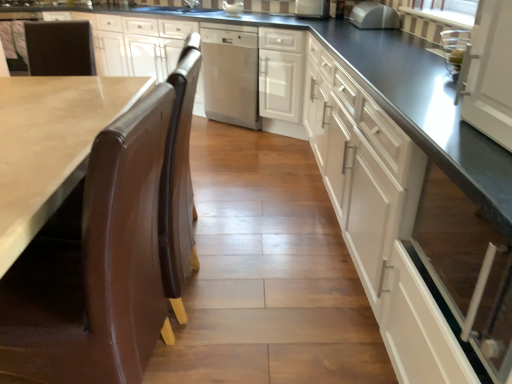
Question: From a real-world perspective, is white glossy cabinet at right, which appears as the first cabinetry when viewed from the front, below satin silver microwave at upper center, which ranks as the third appliance in back-to-front order?

Choices:
 (A) yes
 (B) no

Answer: (A)

Question: From the image's perspective, would you say white glossy cabinet at right, which appears as the first cabinetry when viewed from the front, is shown under satin silver microwave at upper center, which ranks as the third appliance in back-to-front order?

Choices:
 (A) yes
 (B) no

Answer: (A)

Question: Considering the relative sizes of white glossy cabinet at right, the 2th cabinetry in the back-to-front sequence, and satin silver microwave at upper center, the third appliance when ordered from left to right, in the image provided, is white glossy cabinet at right, the 2th cabinetry in the back-to-front sequence, thinner than satin silver microwave at upper center, the third appliance when ordered from left to right,?

Choices:
 (A) yes
 (B) no

Answer: (B)

Question: Is white glossy cabinet at right, which appears as the first cabinetry when viewed from the front, outside of satin silver microwave at upper center, the first appliance viewed from the right?

Choices:
 (A) yes
 (B) no

Answer: (A)

Question: Is white glossy cabinet at right, which appears as the first cabinetry when viewed from the front, facing away from satin silver microwave at upper center, the 1th appliance from the front?

Choices:
 (A) yes
 (B) no

Answer: (B)

Question: Considering the relative sizes of white glossy cabinet at right, the 2th cabinetry in the back-to-front sequence, and satin silver microwave at upper center, the third appliance when ordered from left to right, in the image provided, is white glossy cabinet at right, the 2th cabinetry in the back-to-front sequence, smaller than satin silver microwave at upper center, the third appliance when ordered from left to right,?

Choices:
 (A) no
 (B) yes

Answer: (A)

Question: Is there a large distance between white glossy cabinet at right, the 2th cabinetry in the back-to-front sequence, and stainless steel dishwasher at center?

Choices:
 (A) yes
 (B) no

Answer: (A)

Question: Is the position of white glossy cabinet at right, the 2th cabinetry in the back-to-front sequence, less distant than that of stainless steel dishwasher at center?

Choices:
 (A) no
 (B) yes

Answer: (B)

Question: From a real-world perspective, is white glossy cabinet at right, which appears as the first cabinetry when viewed from the front, under stainless steel dishwasher at center?

Choices:
 (A) yes
 (B) no

Answer: (A)

Question: From the image's perspective, would you say white glossy cabinet at right, the 2th cabinetry in the back-to-front sequence, is positioned over stainless steel dishwasher at center?

Choices:
 (A) no
 (B) yes

Answer: (A)

Question: Is white glossy cabinet at right, which appears as the first cabinetry when viewed from the front, oriented away from stainless steel dishwasher at center?

Choices:
 (A) yes
 (B) no

Answer: (B)

Question: Does white glossy cabinet at right, the 2th cabinetry in the back-to-front sequence, have a greater width compared to stainless steel dishwasher at center?

Choices:
 (A) yes
 (B) no

Answer: (B)

Question: Does white striped fabric at upper right have a greater width compared to white glossy cabinet at right, which appears as the first cabinetry when viewed from the front?

Choices:
 (A) yes
 (B) no

Answer: (B)